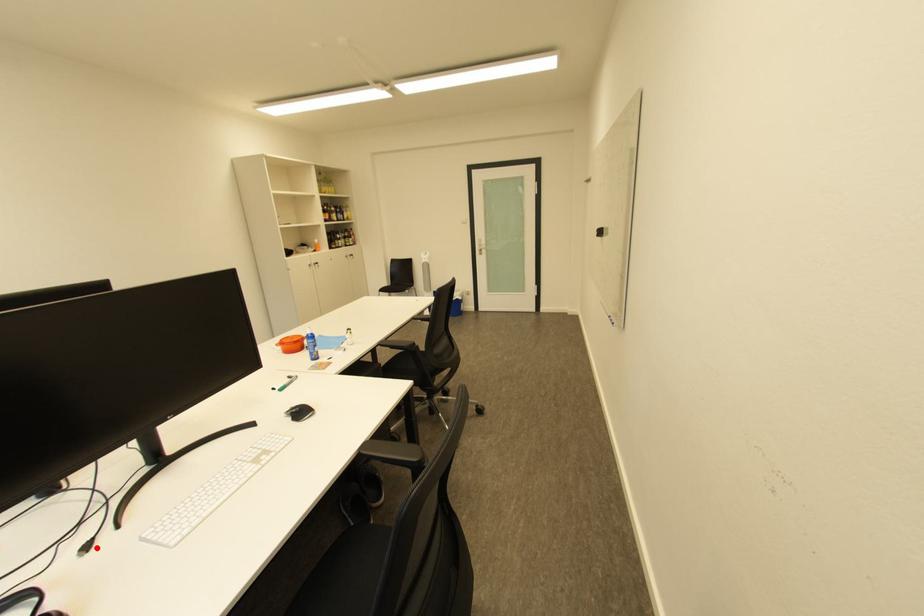
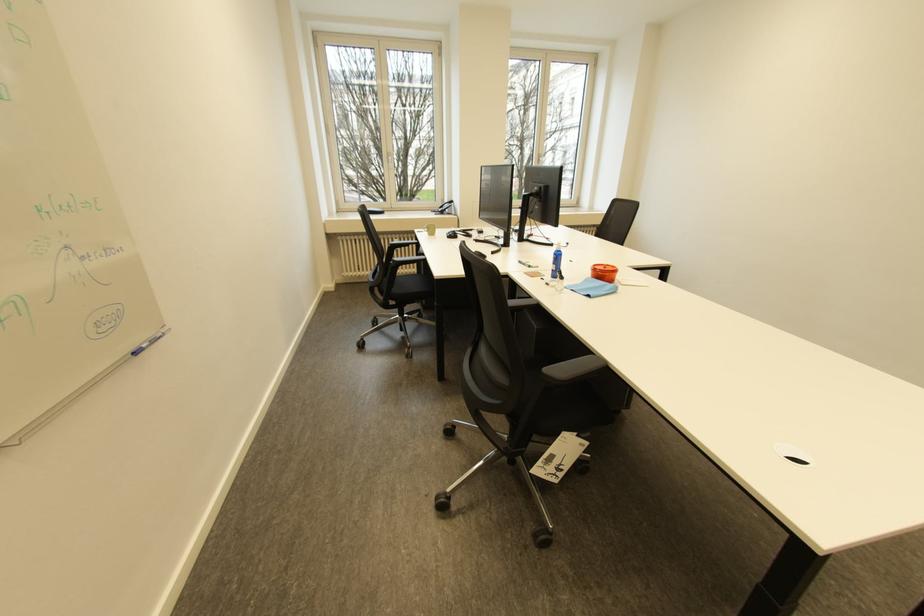
Where in the second image is the point corresponding to the highlighted location from the first image?

(483, 241)